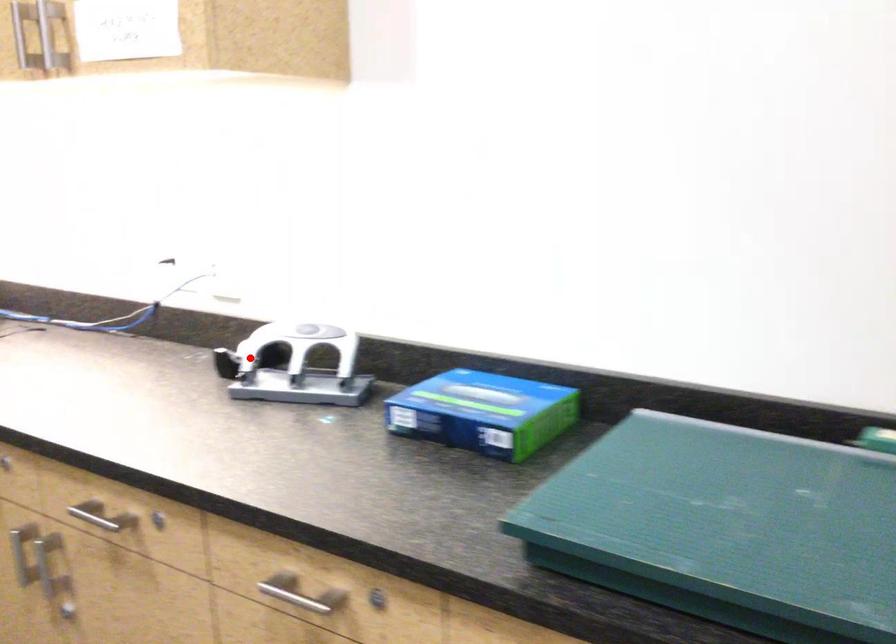
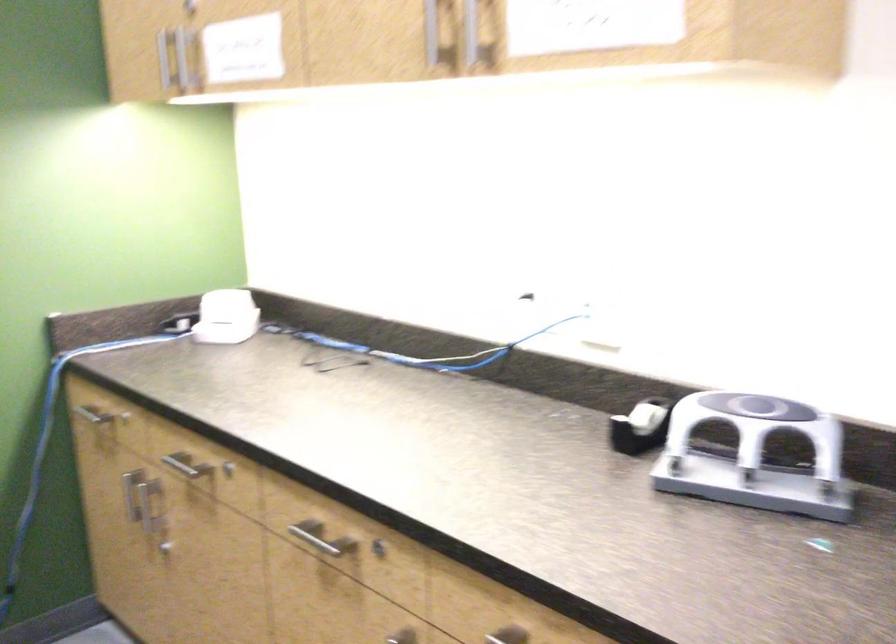
Question: I am providing you with two images of the same scene from different viewpoints. In image1, a red point is highlighted. Considering the same 3D point in image2, which of the following is correct?

Choices:
 (A) It is closer
 (B) It is farther

Answer: (A)